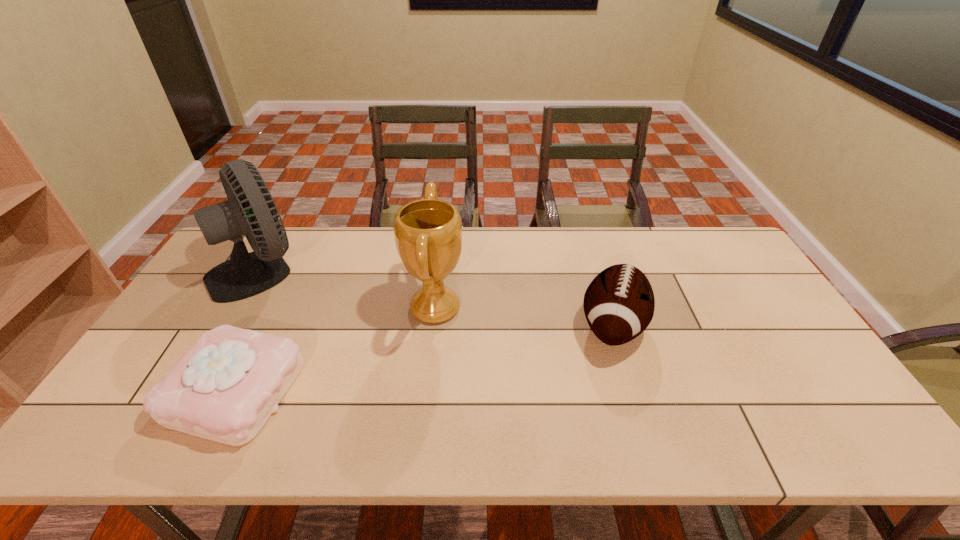
Image resolution: width=960 pixels, height=540 pixels. What are the coordinates of `fan` in the screenshot? It's located at (250, 210).

I want to click on award, so [428, 232].

Identify the location of football (American). (619, 303).

This screenshot has height=540, width=960. Find the location of `the rightmost object`. the rightmost object is located at coordinates (619, 303).

I want to click on the shortest object, so click(x=224, y=388).

You are a GUI agent. You are given a task and a screenshot of the screen. Output one action in this format:
    pyautogui.click(x=<x>, y=<y>)
    Task: Click on the free region located 0.050m in front of the fan to direct airflow
    Image resolution: width=960 pixels, height=540 pixels.
    Given the screenshot: What is the action you would take?
    pyautogui.click(x=324, y=269)

This screenshot has width=960, height=540. Find the location of `free space located on the front of the award with the decoration`. free space located on the front of the award with the decoration is located at coordinates (533, 308).

Where is `vacant region located 0.320m on the back of the football (American)`? The image size is (960, 540). vacant region located 0.320m on the back of the football (American) is located at coordinates (584, 231).

You are a GUI agent. You are given a task and a screenshot of the screen. Output one action in this format:
    pyautogui.click(x=<x>, y=<y>)
    Task: Click on the vacant space situated on the back of the cake
    Image resolution: width=960 pixels, height=540 pixels.
    Given the screenshot: What is the action you would take?
    pyautogui.click(x=280, y=300)

The height and width of the screenshot is (540, 960). In order to click on object present at the far edge in this screenshot , I will do `click(250, 210)`.